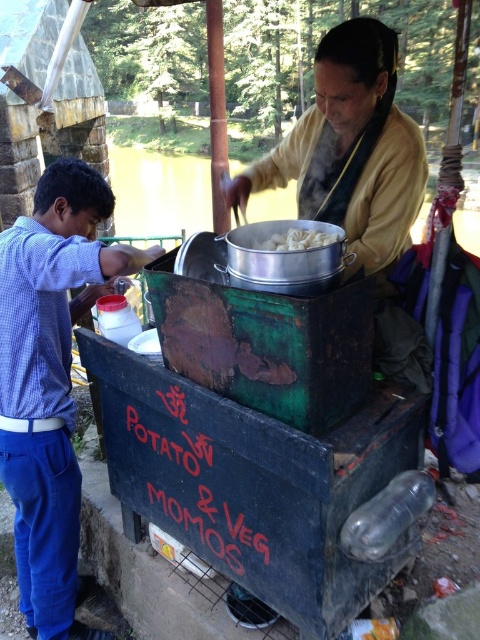
You are a customer at the Potato and Veg Momos stall. You notice a point marked at coordinates (350,148) on the stall. What object is located at this point?

The point at coordinates (350,148) marks the location of the matte yellow shirt at center.